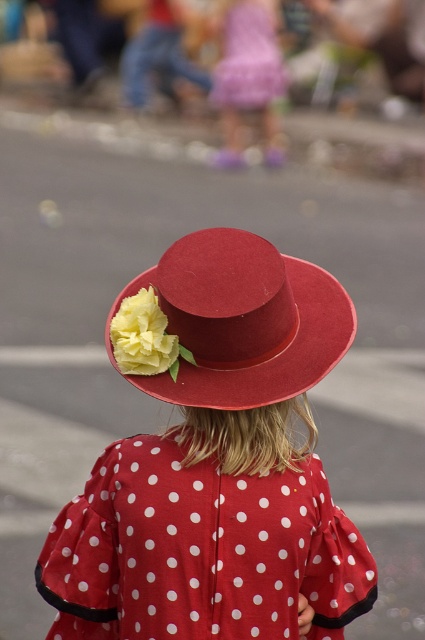
Does point (316, 321) lie behind point (269, 97)?

No, it is in front of (269, 97).

Identify the location of matte red hat at center. The height and width of the screenshot is (640, 425). (235, 323).

Between matte red hat at center and yellow fabric flower at center, which one has less height?

With less height is yellow fabric flower at center.

Does matte red hat at center appear over yellow fabric flower at center?

Indeed, matte red hat at center is positioned over yellow fabric flower at center.

Who is more forward, (x=334, y=321) or (x=118, y=333)?

Point (x=118, y=333) is in front.

Identify the location of matte red hat at center. (235, 323).

Between matte felt hat at center and matte red hat at center, which one has less height?

Standing shorter between the two is matte red hat at center.

Between matte felt hat at center and matte red hat at center, which one appears on the left side from the viewer's perspective?

From the viewer's perspective, matte felt hat at center appears more on the left side.

You are a GUI agent. You are given a task and a screenshot of the screen. Output one action in this format:
    pyautogui.click(x=<x>, y=<y>)
    Task: Click on the matte felt hat at center
    This screenshot has width=425, height=640.
    Given the screenshot: What is the action you would take?
    pyautogui.click(x=218, y=467)